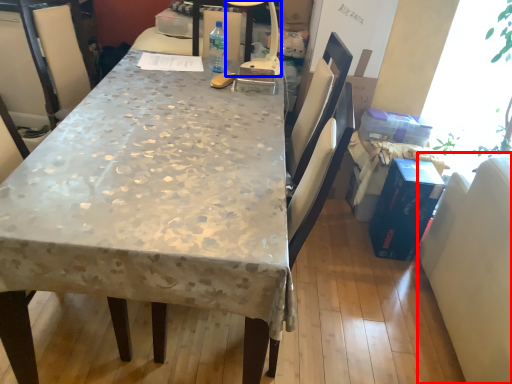
Question: Which object appears closest to the camera in this image, swivel chair (highlighted by a red box) or lamp (highlighted by a blue box)?

Choices:
 (A) swivel chair
 (B) lamp

Answer: (A)